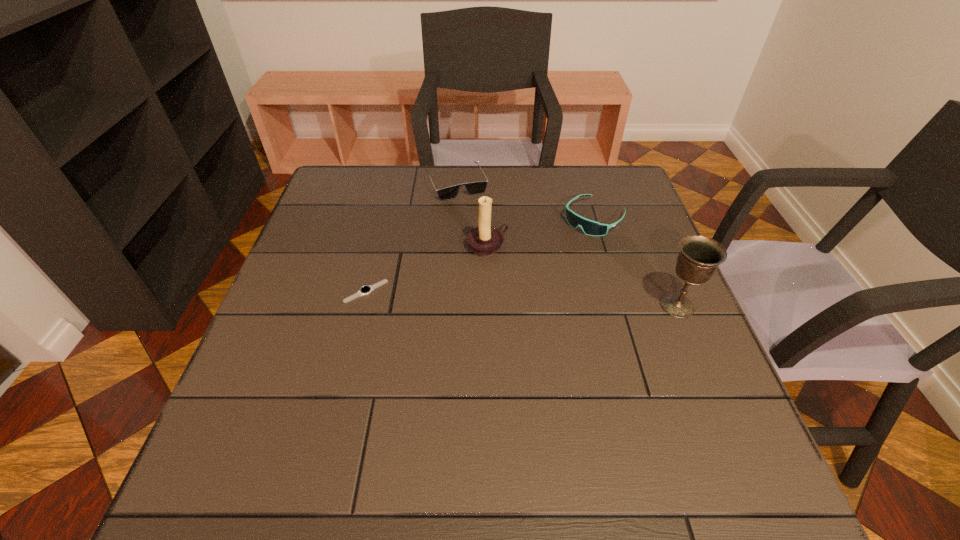
Locate an element on the screen. The width and height of the screenshot is (960, 540). vacant space on the desktop that is between the leftmost object and the chalice and is positioned on the front-facing side of the taller sunglasses is located at coordinates (508, 298).

This screenshot has height=540, width=960. Find the location of `free space on the desktop that is between the watch and the chalice and is positioned on the front-facing side of the second shortest object`. free space on the desktop that is between the watch and the chalice and is positioned on the front-facing side of the second shortest object is located at coordinates (516, 298).

In order to click on free spot on the desktop that is between the leftmost object and the chalice and is positioned on the wick of the candle holder in this screenshot , I will do `click(550, 300)`.